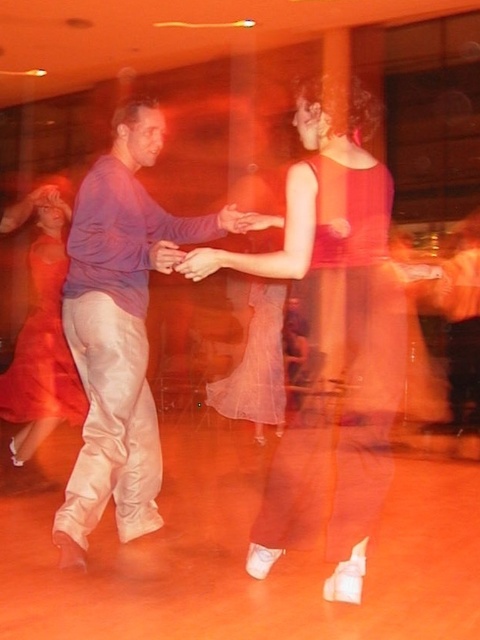
Consider the image. Who is positioned more to the left, matte red dress at center or matte purple shirt at left?

From the viewer's perspective, matte purple shirt at left appears more on the left side.

Is matte red dress at center behind matte purple shirt at left?

No, it is not.

Find the location of a particular element. matte red dress at center is located at coordinates (335, 342).

Does matte red dress at center appear over matte skin hand at center?

Incorrect, matte red dress at center is not positioned above matte skin hand at center.

Describe the element at coordinates (335, 342) in the screenshot. I see `matte red dress at center` at that location.

What are the coordinates of `matte red dress at center` in the screenshot? It's located at (335, 342).

Can you confirm if translucent pink fabric at center is smaller than matte skin hand at center?

No.

Is translucent pink fabric at center closer to camera compared to matte skin hand at center?

No, it is behind matte skin hand at center.

Locate an element on the screen. The image size is (480, 640). translucent pink fabric at center is located at coordinates (256, 364).

Where is `translucent pink fabric at center`? This screenshot has height=640, width=480. translucent pink fabric at center is located at coordinates (x=256, y=364).